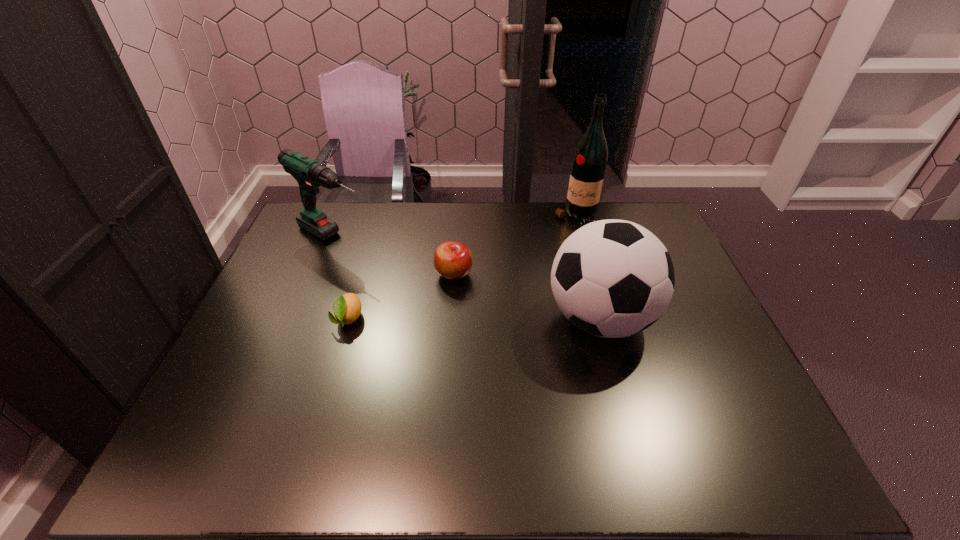
I want to click on the shortest object, so click(x=347, y=308).

Where is `soccer ball`? Image resolution: width=960 pixels, height=540 pixels. soccer ball is located at coordinates (612, 278).

Identify the location of wine bottle. (589, 162).

Identify the location of the second shortest object. (452, 260).

Locate an element on the screen. The image size is (960, 540). apple is located at coordinates (452, 260).

This screenshot has width=960, height=540. Find the location of `drill`. drill is located at coordinates (310, 175).

At what (x,y) coordinates should I click in order to perform the action: click on vacant area situated with leaves positioned above the shortest object. Please return your answer as a coordinate pair (x, y). Looking at the image, I should click on (321, 409).

The image size is (960, 540). I want to click on vacant region located on the back of the soccer ball, so point(571,213).

This screenshot has height=540, width=960. Find the location of `vacant space located 0.370m on the surface of the wine bottle`. vacant space located 0.370m on the surface of the wine bottle is located at coordinates (513, 290).

The height and width of the screenshot is (540, 960). Find the location of `vacant space located 0.110m on the surface of the wine bottle`. vacant space located 0.110m on the surface of the wine bottle is located at coordinates (553, 245).